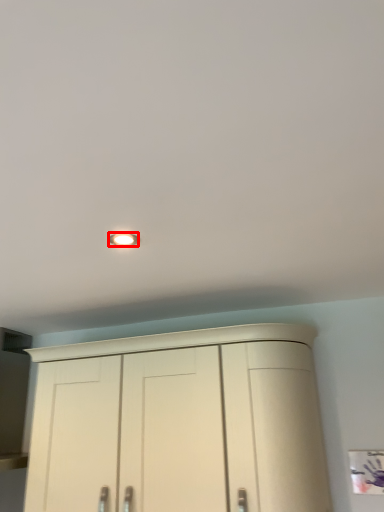
Question: From the image, what is the correct spatial relationship of lighting (annotated by the red box) in relation to cupboard?

Choices:
 (A) right
 (B) left

Answer: (B)